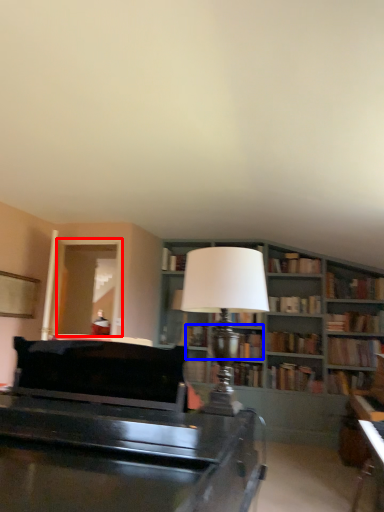
Question: Which point is closer to the camera, glass door (highlighted by a red box) or book (highlighted by a blue box)?

Choices:
 (A) glass door
 (B) book

Answer: (A)